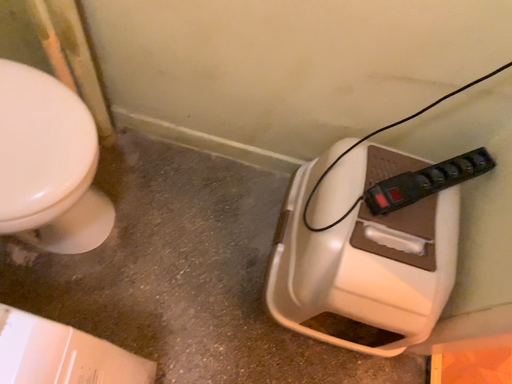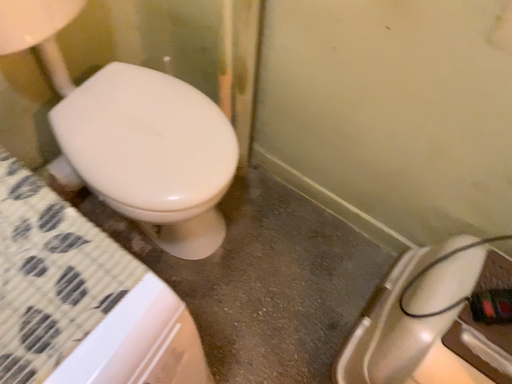
Question: How did the camera likely rotate when shooting the video?

Choices:
 (A) rotated downward
 (B) rotated upward

Answer: (B)